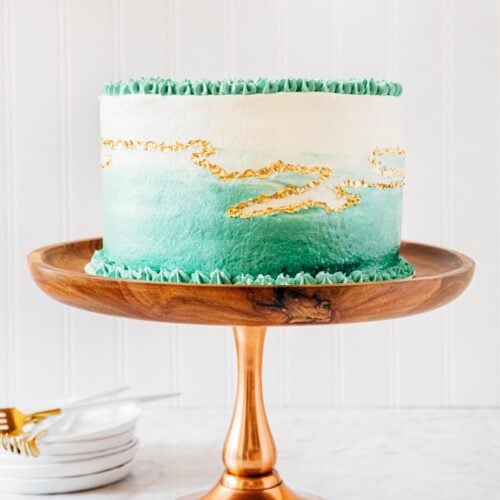
Identify the location of tray. (294, 305).